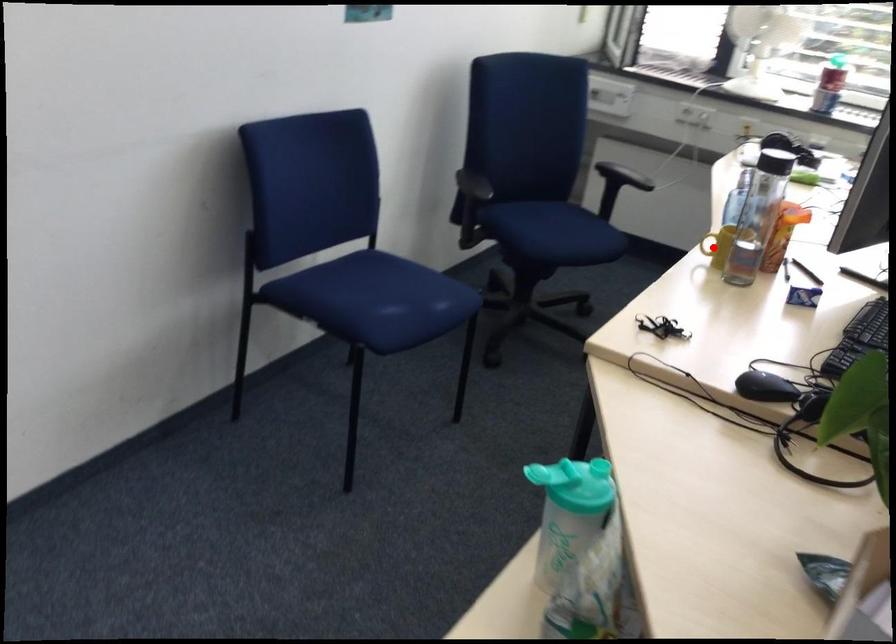
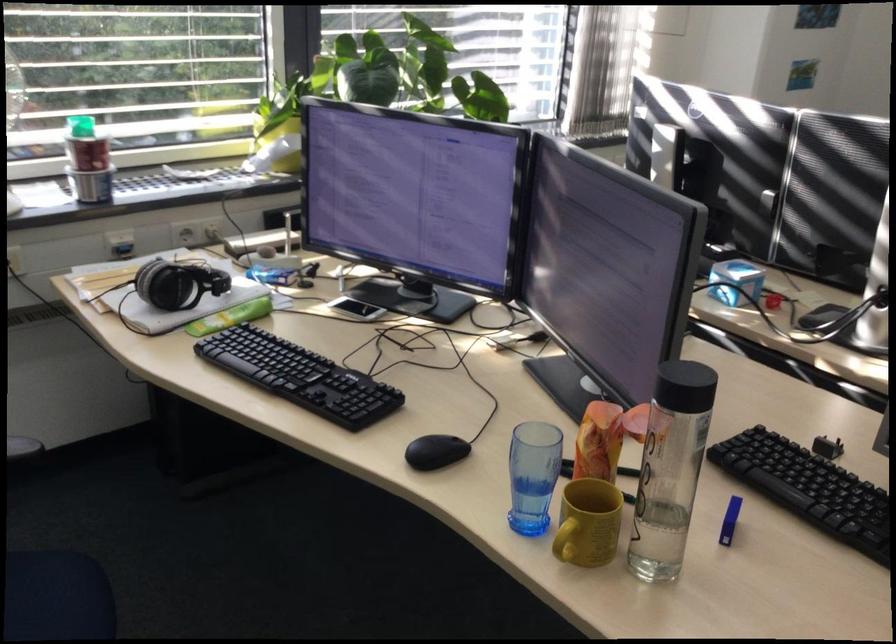
Question: I am providing you with two images of the same scene from different viewpoints. Given a red point in image1, look at the same physical point in image2. Is it:

Choices:
 (A) Closer to the viewpoint
 (B) Farther from the viewpoint

Answer: (A)